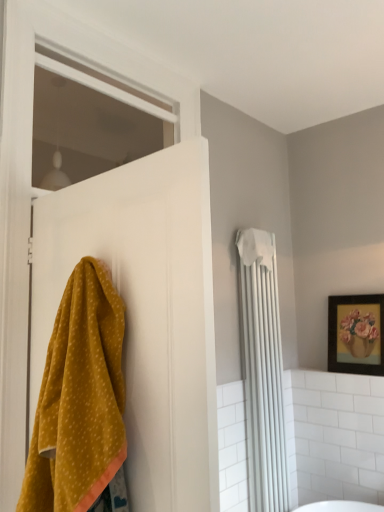
The height and width of the screenshot is (512, 384). What do you see at coordinates (262, 371) in the screenshot?
I see `white fabric towel at upper right` at bounding box center [262, 371].

The height and width of the screenshot is (512, 384). In order to click on mustard yellow towel at left in this screenshot , I will do `click(79, 398)`.

Who is more distant, yellow fabric at left or white matte window at upper left?

white matte window at upper left is further away from the camera.

From a real-world perspective, is yellow fabric at left positioned above or below white matte window at upper left?

Clearly, from a real-world perspective, yellow fabric at left is below white matte window at upper left.

Is yellow fabric at left facing towards white matte window at upper left?

Yes, yellow fabric at left is turned towards white matte window at upper left.

From the image's perspective, which is below, mustard yellow towel at left or wooden framed painting at upper right?

From the image's view, wooden framed painting at upper right is below.

Where is `picture frame above the mustard yellow towel at left (from a real-world perspective)`? The image size is (384, 512). picture frame above the mustard yellow towel at left (from a real-world perspective) is located at coordinates (356, 333).

Does mustard yellow towel at left turn towards wooden framed painting at upper right?

No.

From a real-world perspective, which is physically above, yellow fabric at left or white fabric towel at upper right?

yellow fabric at left is physically above.

Which of these two, yellow fabric at left or white fabric towel at upper right, is thinner?

yellow fabric at left.

From the image's perspective, is yellow fabric at left located above or below white fabric towel at upper right?

From the image's perspective, yellow fabric at left appears above white fabric towel at upper right.

Which is correct: yellow fabric at left is inside white fabric towel at upper right, or outside of it?

The correct answer is: outside.

Identify the location of door located above the mustard yellow towel at left (from a real-world perspective). The image size is (384, 512). (146, 312).

Considering the relative positions of mustard yellow towel at left and yellow fabric at left in the image provided, is mustard yellow towel at left to the left or to the right of yellow fabric at left?

mustard yellow towel at left is positioned on yellow fabric at left's right side.

Is mustard yellow towel at left oriented away from yellow fabric at left?

No, mustard yellow towel at left is not facing away from yellow fabric at left.

Considering the sizes of objects mustard yellow towel at left and yellow fabric at left in the image provided, who is smaller, mustard yellow towel at left or yellow fabric at left?

mustard yellow towel at left.

Considering the relative positions of white fabric towel at upper right and mustard yellow towel at left in the image provided, is white fabric towel at upper right to the right of mustard yellow towel at left from the viewer's perspective?

Indeed, white fabric towel at upper right is positioned on the right side of mustard yellow towel at left.

Do you think white fabric towel at upper right is within mustard yellow towel at left, or outside of it?

white fabric towel at upper right is spatially situated outside mustard yellow towel at left.

How many degrees apart are the facing directions of white fabric towel at upper right and mustard yellow towel at left?

white fabric towel at upper right and mustard yellow towel at left are facing 89.6 degrees away from each other.

Does white fabric towel at upper right have a lesser width compared to mustard yellow towel at left?

Yes, white fabric towel at upper right is thinner than mustard yellow towel at left.

From a real-world perspective, is white fabric towel at upper right under wooden framed painting at upper right?

Yes, from a real-world perspective, white fabric towel at upper right is under wooden framed painting at upper right.

I want to click on picture frame above the white fabric towel at upper right (from the image's perspective), so click(356, 333).

How many degrees apart are the facing directions of white fabric towel at upper right and wooden framed painting at upper right?

They differ by 91.2 degrees in their facing directions.

Considering the relative sizes of white fabric towel at upper right and wooden framed painting at upper right in the image provided, is white fabric towel at upper right shorter than wooden framed painting at upper right?

No.

Which is less distant, (171,130) or (61,260)?

The point (61,260) is more forward.

From the image's perspective, would you say white matte window at upper left is shown under yellow fabric at left?

No.

I want to click on door to the right of white matte window at upper left, so click(x=146, y=312).

Identify the location of window that is above the yellow fabric at left (from a real-world perspective). (88, 123).

Locate an element on the screen. The height and width of the screenshot is (512, 384). picture frame located on the right of mustard yellow towel at left is located at coordinates (356, 333).

Estimate the real-world distances between objects in this image. Which object is further from yellow fabric at left, mustard yellow towel at left or wooden framed painting at upper right?

The object further to yellow fabric at left is wooden framed painting at upper right.

Considering their positions, is white fabric towel at upper right positioned closer to white matte window at upper left than wooden framed painting at upper right?

white fabric towel at upper right is positioned closer to the anchor white matte window at upper left.

Based on their spatial positions, is white matte window at upper left or yellow fabric at left further from white fabric towel at upper right?

Among the two, white matte window at upper left is located further to white fabric towel at upper right.

Which object lies further to the anchor point wooden framed painting at upper right, mustard yellow towel at left or white fabric towel at upper right?

The object further to wooden framed painting at upper right is mustard yellow towel at left.

When comparing their distances from mustard yellow towel at left, does wooden framed painting at upper right or yellow fabric at left seem further?

wooden framed painting at upper right is positioned further to the anchor mustard yellow towel at left.

Looking at the image, which one is located closer to wooden framed painting at upper right, white fabric towel at upper right or yellow fabric at left?

white fabric towel at upper right lies closer to wooden framed painting at upper right than the other object.

When comparing their distances from white fabric towel at upper right, does mustard yellow towel at left or wooden framed painting at upper right seem further?

mustard yellow towel at left is further to white fabric towel at upper right.

Looking at the image, which one is located further to wooden framed painting at upper right, yellow fabric at left or white matte window at upper left?

The object further to wooden framed painting at upper right is white matte window at upper left.

This screenshot has height=512, width=384. Find the location of `door between white matte window at upper left and white fabric towel at upper right from top to bottom`. door between white matte window at upper left and white fabric towel at upper right from top to bottom is located at coordinates (146, 312).

Where is `door between mustard yellow towel at left and white fabric towel at upper right in the front-back direction`? door between mustard yellow towel at left and white fabric towel at upper right in the front-back direction is located at coordinates (146, 312).

Image resolution: width=384 pixels, height=512 pixels. Identify the location of shower curtain located between yellow fabric at left and wooden framed painting at upper right in the left-right direction. (262, 371).

Find the location of a particular element. towel between white matte window at upper left and wooden framed painting at upper right in the horizontal direction is located at coordinates (79, 398).